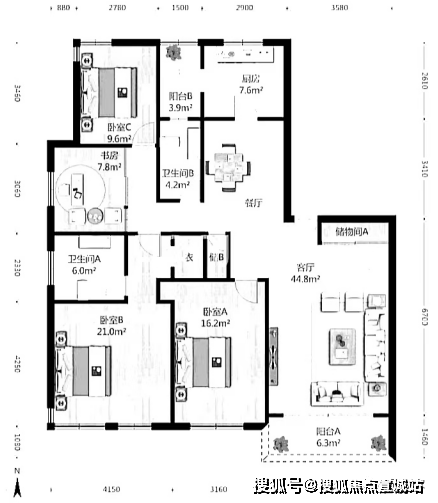
Find the location of `entrance`. entrance is located at coordinates (311, 220), (245, 118), (180, 123), (141, 145), (147, 233), (128, 285), (216, 234), (173, 259), (248, 282).